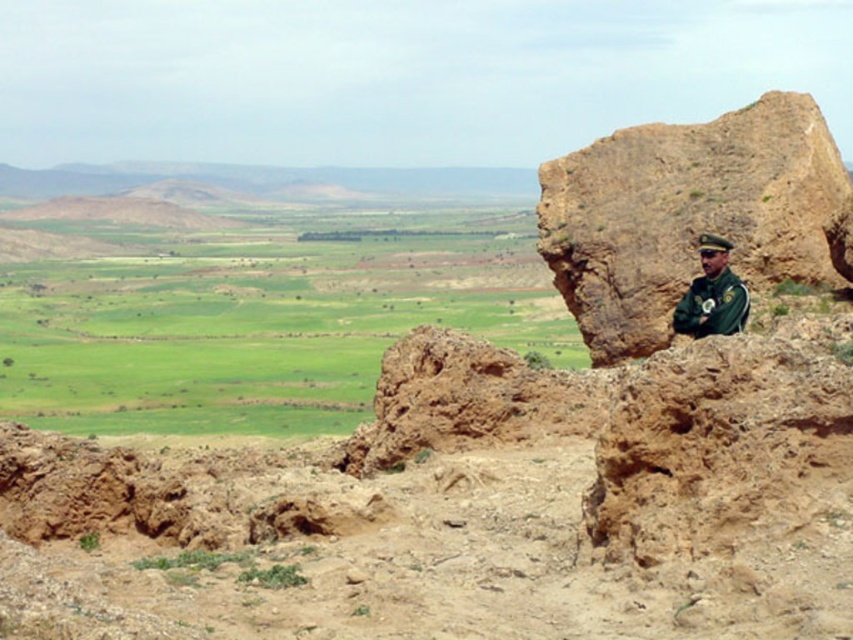
Which of these two, green grassland at center or green uniform at right, stands shorter?

With less height is green uniform at right.

Which is in front, point (473, 308) or point (718, 257)?

Point (718, 257) is more forward.

Image resolution: width=853 pixels, height=640 pixels. I want to click on green grassland at center, so click(258, 317).

Is green grassland at center to the left of brown rough rock at right from the viewer's perspective?

Correct, you'll find green grassland at center to the left of brown rough rock at right.

The width and height of the screenshot is (853, 640). Describe the element at coordinates (258, 317) in the screenshot. I see `green grassland at center` at that location.

This screenshot has width=853, height=640. What do you see at coordinates (258, 317) in the screenshot?
I see `green grassland at center` at bounding box center [258, 317].

Find the location of a particular element. This screenshot has width=853, height=640. green grassland at center is located at coordinates (258, 317).

Can you confirm if brown rough rock at right is thinner than green uniform at right?

Incorrect, brown rough rock at right's width is not less than green uniform at right's.

Does brown rough rock at right appear over green uniform at right?

Yes.

Describe the element at coordinates (686, 214) in the screenshot. I see `brown rough rock at right` at that location.

Where is `brown rough rock at right`? The height and width of the screenshot is (640, 853). brown rough rock at right is located at coordinates (686, 214).